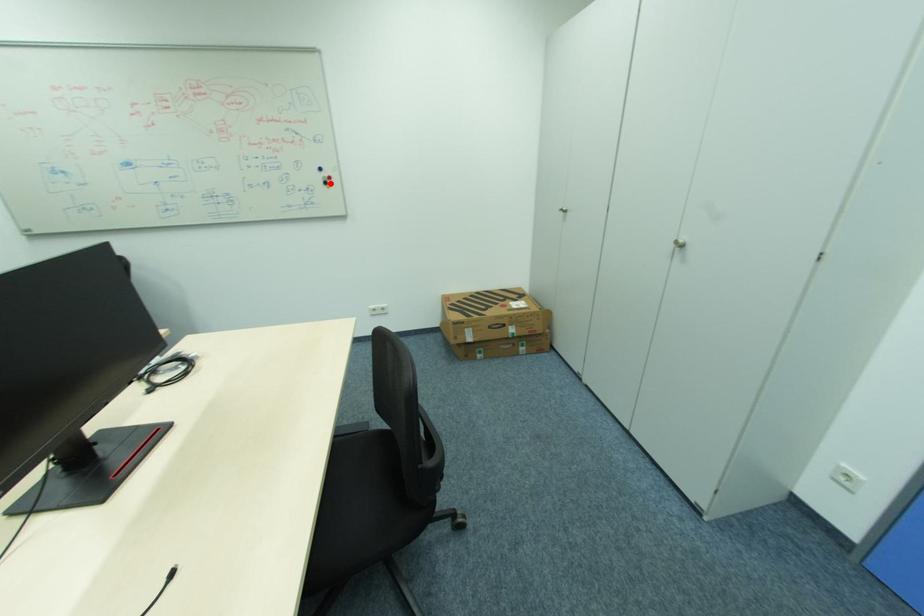
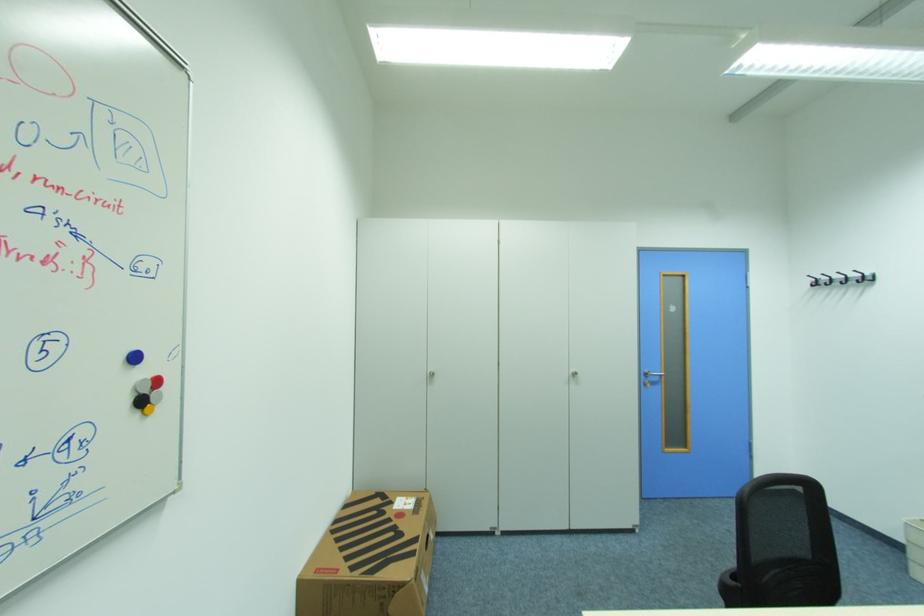
Question: A red point is marked in image1. In image2, is the corresponding 3D point closer to the camera or farther? Reply with the corresponding letter.

Choices:
 (A) The corresponding 3D point is closer.
 (B) The corresponding 3D point is farther.

Answer: (B)